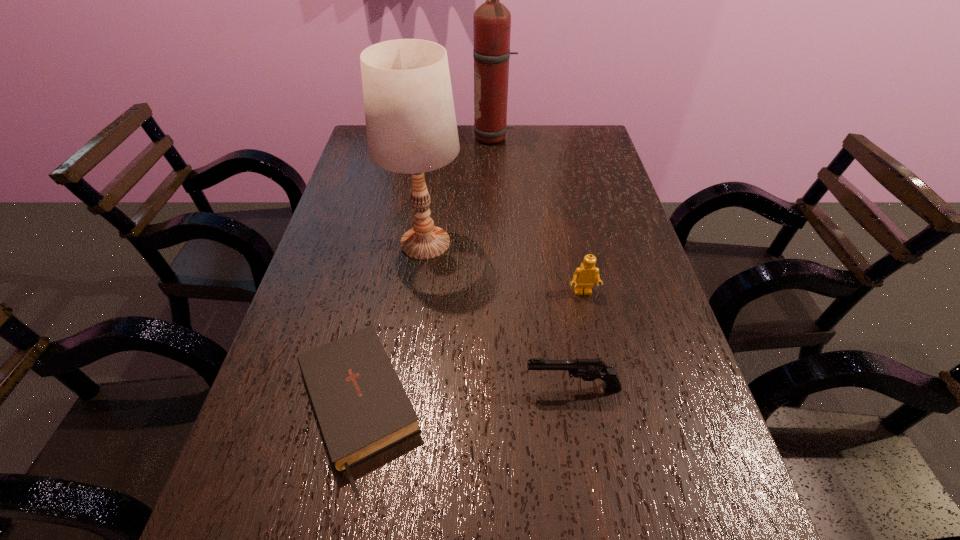
Where is `free space located 0.340m at the end of the barrel of the gun`? free space located 0.340m at the end of the barrel of the gun is located at coordinates (348, 388).

The image size is (960, 540). In order to click on vacant space located at the end of the barrel of the gun in this screenshot , I will do click(323, 388).

At what (x,y) coordinates should I click in order to perform the action: click on free location located 0.350m at the end of the barrel of the gun. Please return your answer as a coordinate pair (x, y). Looking at the image, I should click on (343, 388).

I want to click on free location located 0.350m on the back of the shortest object, so click(394, 232).

In order to click on object present at the far edge in this screenshot , I will do `click(492, 20)`.

I want to click on object located in the left edge section of the desktop, so click(x=361, y=407).

The height and width of the screenshot is (540, 960). Identify the location of Lego situated at the right edge. (585, 276).

Find the location of `gun at the right edge`. gun at the right edge is located at coordinates (588, 369).

Identify the location of vacant space at the far edge of the desktop. (485, 146).

In the image, there is a desktop. In order to click on vacant space at the left edge in this screenshot , I will do `click(322, 252)`.